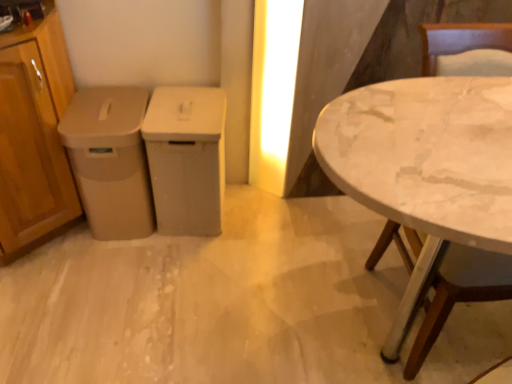
You are a GUI agent. You are given a task and a screenshot of the screen. Output one action in this format:
    pyautogui.click(x=<x>, y=<y>)
    Task: Click on the free space in front of matte plastic trash can at center, the 3th cabinetry in the left-to-right sequence
    The height and width of the screenshot is (384, 512).
    Given the screenshot: What is the action you would take?
    pyautogui.click(x=183, y=264)